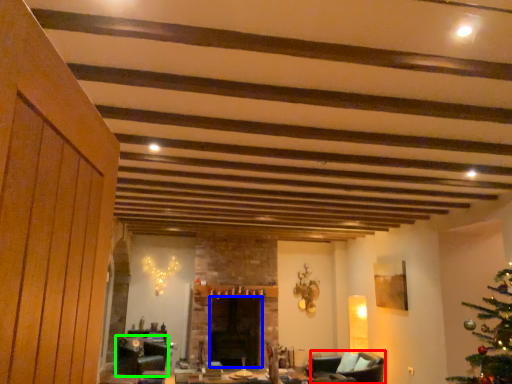
Question: Which object is the farthest from armchair (highlighted by a red box)? Choose among these: fireplace (highlighted by a blue box) or swivel chair (highlighted by a green box).

Choices:
 (A) fireplace
 (B) swivel chair

Answer: (B)